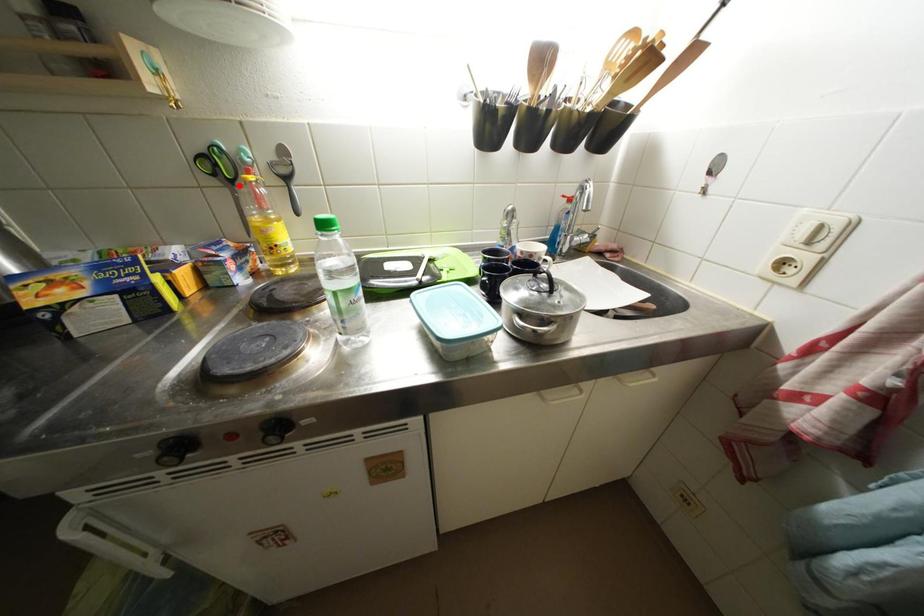
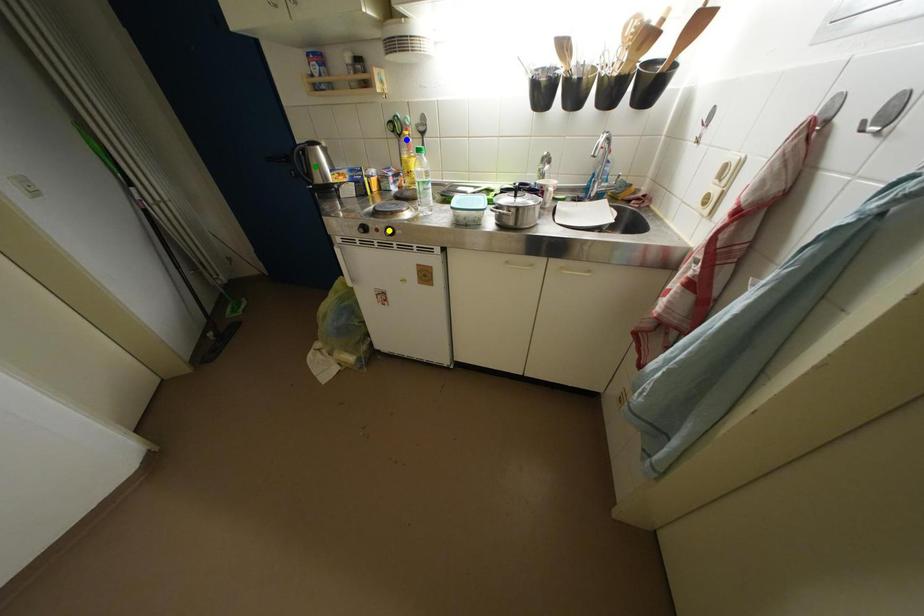
Question: I am providing you with two images of the same scene from different viewpoints. A red point is marked on the first image. You are given multiple points on the second image. In image 2, which mark is for the same physical point as the one in image 1?

Choices:
 (A) blue point
 (B) green point
 (C) yellow point

Answer: (A)